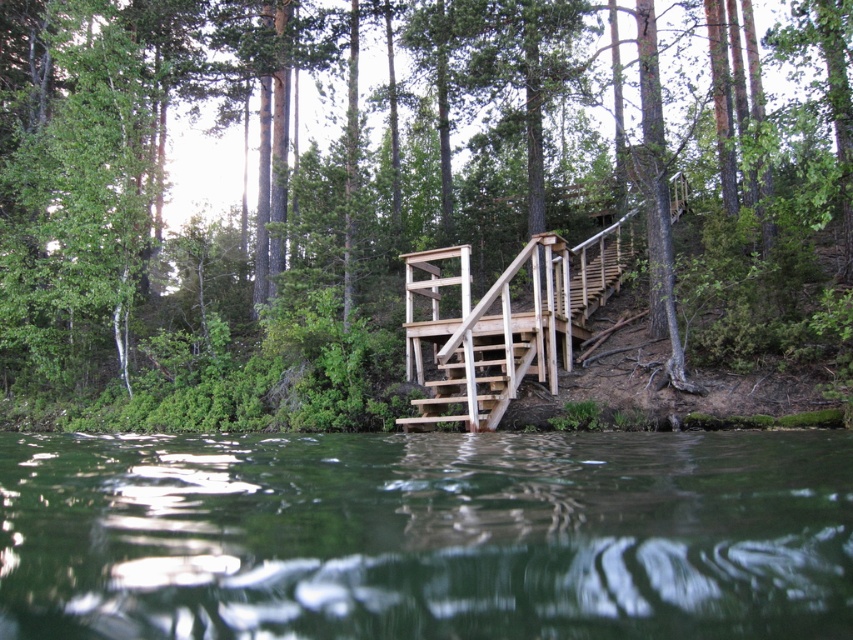
Is green liquid water at center to the right of wooden stairs at center from the viewer's perspective?

Indeed, green liquid water at center is positioned on the right side of wooden stairs at center.

Where is `green liquid water at center`? green liquid water at center is located at coordinates (426, 536).

Where is `green liquid water at center`? The width and height of the screenshot is (853, 640). green liquid water at center is located at coordinates (426, 536).

Describe the element at coordinates (404, 209) in the screenshot. I see `green wood tree at upper center` at that location.

Can you confirm if green wood tree at upper center is shorter than wooden rail at center?

No.

Who is more forward, (135, 307) or (474, 307)?

Point (474, 307)

Identify the location of green wood tree at upper center. (404, 209).

Consider the image. Is green wood tree at upper center closer to camera compared to wooden stairs at center?

Yes, it is in front of wooden stairs at center.

Does point (814, 166) come farther from viewer compared to point (488, 416)?

No, (814, 166) is in front of (488, 416).

At what (x,y) coordinates should I click in order to perform the action: click on green wood tree at upper center. Please return your answer as a coordinate pair (x, y). Looking at the image, I should click on (404, 209).